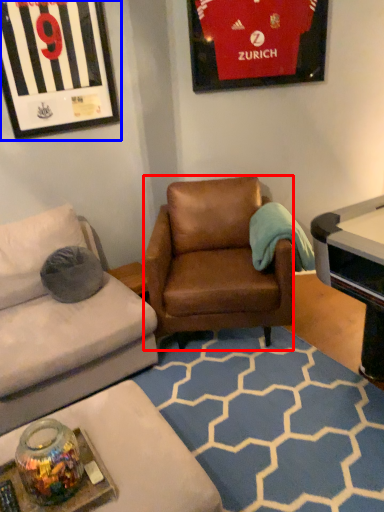
Question: Which object is further to the camera taking this photo, chair (highlighted by a red box) or picture frame (highlighted by a blue box)?

Choices:
 (A) chair
 (B) picture frame

Answer: (B)